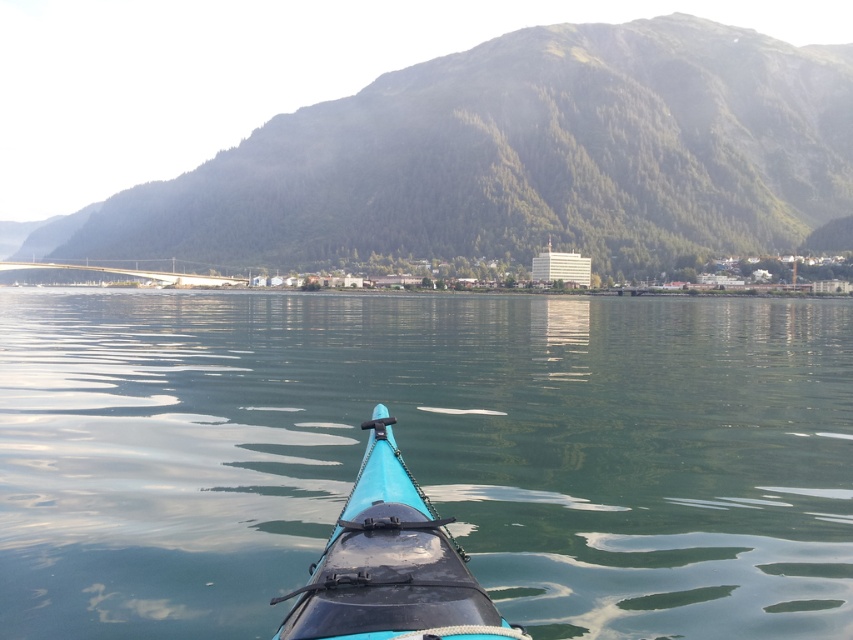
Question: Does green smooth water at center appear on the left side of green forested mountain at upper center?

Choices:
 (A) no
 (B) yes

Answer: (A)

Question: Does green smooth water at center appear on the right side of teal matte kayak at center?

Choices:
 (A) no
 (B) yes

Answer: (A)

Question: In this image, where is green smooth water at center located relative to green forested mountain at upper center?

Choices:
 (A) below
 (B) above

Answer: (A)

Question: Among these objects, which one is farthest from the camera?

Choices:
 (A) green forested mountain at upper center
 (B) teal matte kayak at center

Answer: (A)

Question: Which of the following is the farthest from the observer?

Choices:
 (A) (410, 506)
 (B) (579, 45)
 (C) (28, 456)

Answer: (B)

Question: Considering the real-world distances, which object is closest to the green smooth water at center?

Choices:
 (A) green forested mountain at upper center
 (B) teal matte kayak at center

Answer: (B)